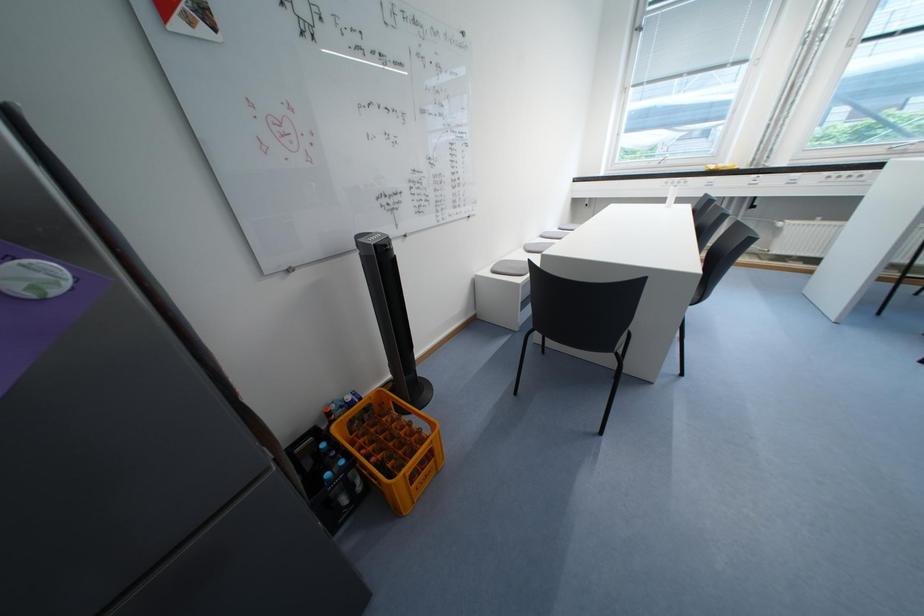
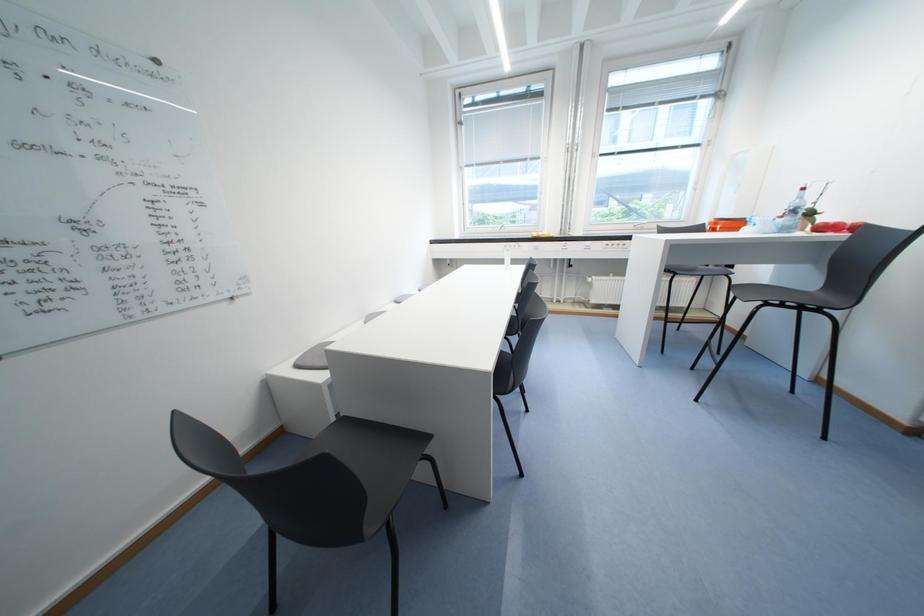
What movement of the cameraman would produce the second image?

The cameraman moved toward right, forward.